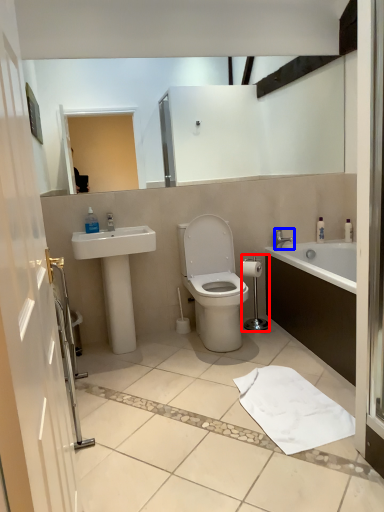
Question: Which object is further to the camera taking this photo, shower (highlighted by a red box) or tap (highlighted by a blue box)?

Choices:
 (A) shower
 (B) tap

Answer: (B)